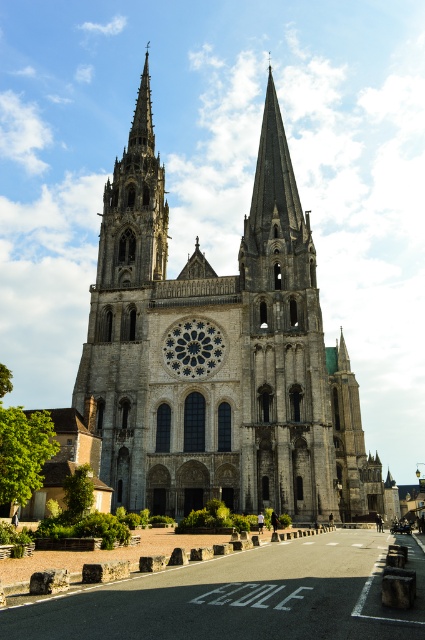
Who is shorter, gray stone church at center or dark gray stone rose window at center?

dark gray stone rose window at center

Does point (113, 324) come behind point (207, 339)?

Yes, point (113, 324) is farther from viewer.

I want to click on gray stone church at center, so click(x=223, y=355).

Identify the location of gray stone church at center. The image size is (425, 640). (223, 355).

Can you confirm if gray stone church at center is thinner than smooth stone spire at upper left?

No.

Is point (176, 499) behind point (136, 208)?

That is False.

Does point (116, 269) come behind point (115, 280)?

Yes, it is.

You are a GUI agent. You are given a task and a screenshot of the screen. Output one action in this format:
    pyautogui.click(x=<x>, y=<y>)
    Task: Click on the gray stone church at center
    This screenshot has height=640, width=425.
    Given the screenshot: What is the action you would take?
    coord(223,355)

In the scene shown: Who is more forward, [164,234] or [192,365]?

Point [192,365] is in front.

Between smooth stone spire at upper left and dark gray stone rose window at center, which one has more height?

smooth stone spire at upper left is taller.

Is point (121, 204) closer to camera compared to point (180, 369)?

No, (121, 204) is further to viewer.

This screenshot has height=640, width=425. Find the location of `smooth stone spire at upper left`. smooth stone spire at upper left is located at coordinates (135, 205).